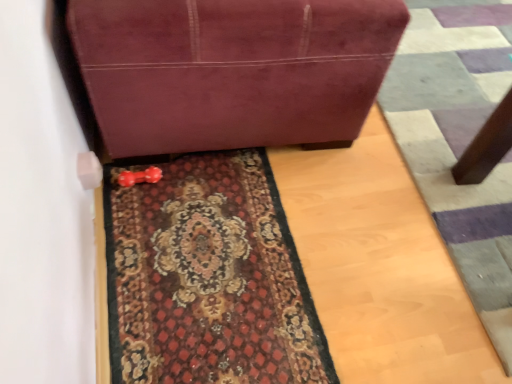
Question: Considering the positions of carpeted mat at center and suede-like maroon sofa at upper center in the image, is carpeted mat at center bigger or smaller than suede-like maroon sofa at upper center?

Choices:
 (A) small
 (B) big

Answer: (A)

Question: Is carpeted mat at center to the left or to the right of suede-like maroon sofa at upper center in the image?

Choices:
 (A) left
 (B) right

Answer: (A)

Question: Considering the real-world distances, which object is farthest from the carpeted doormat at lower center?

Choices:
 (A) suede-like maroon sofa at upper center
 (B) carpeted mat at center

Answer: (B)

Question: Which of these objects is positioned farthest from the suede-like maroon sofa at upper center?

Choices:
 (A) carpeted doormat at lower center
 (B) carpeted mat at center

Answer: (A)